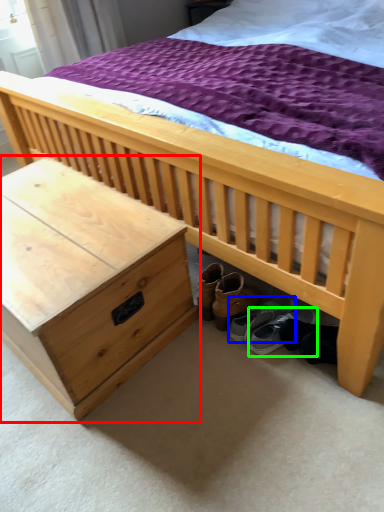
Question: Which is nearer to the nightstand (highlighted by a red box)? footwear (highlighted by a blue box) or footwear (highlighted by a green box).

Choices:
 (A) footwear
 (B) footwear

Answer: (A)